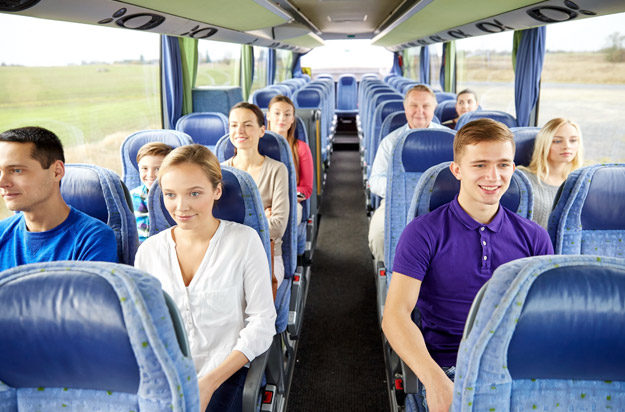
Find the location of a particular element. This screenshot has height=412, width=625. window is located at coordinates (562, 75), (496, 54), (436, 49), (411, 55), (337, 49), (284, 62), (260, 58), (221, 56), (112, 74).